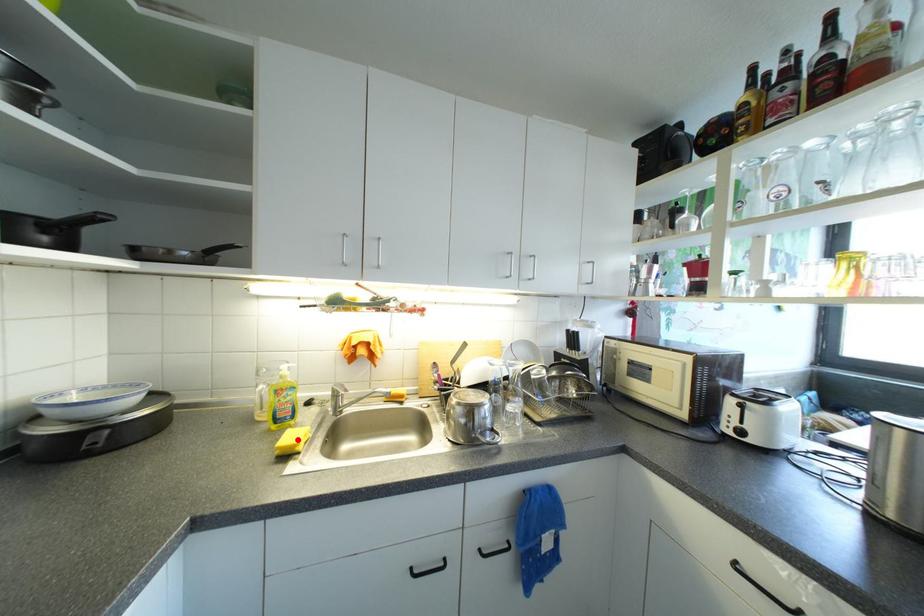
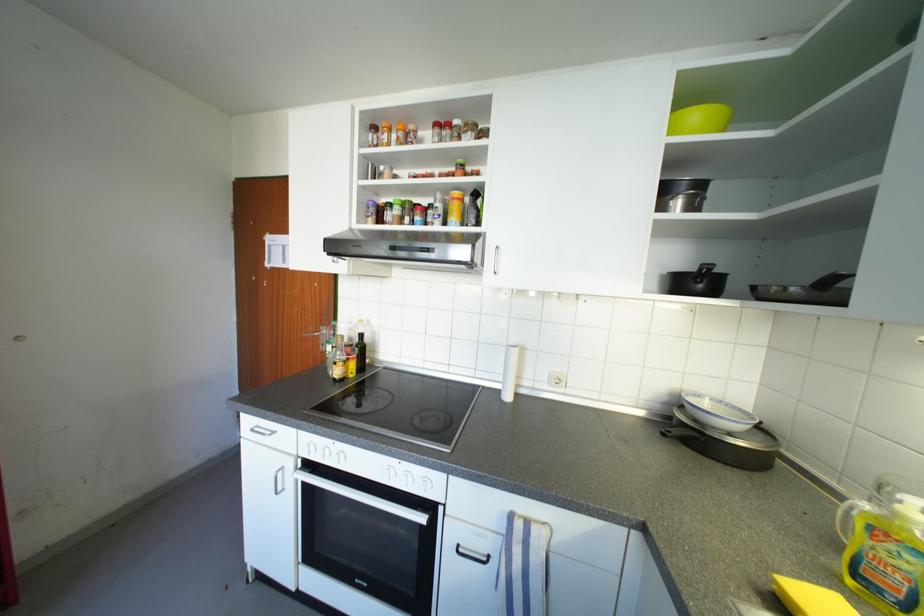
Where in the second image is the point corresponding to the highlighted location from the first image?

(824, 602)